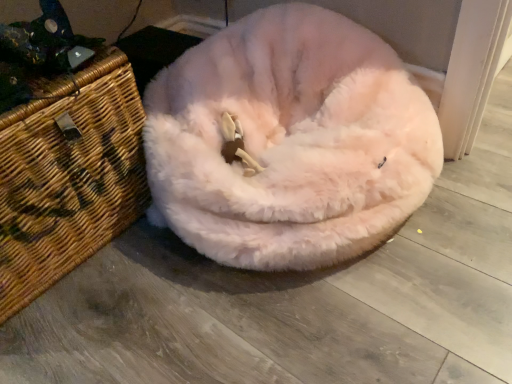
Question: Is woven brown basket at left positioned with its back to fuzzy white dog bed at center?

Choices:
 (A) no
 (B) yes

Answer: (A)

Question: Considering the relative sizes of woven brown basket at left and fuzzy white dog bed at center in the image provided, is woven brown basket at left shorter than fuzzy white dog bed at center?

Choices:
 (A) no
 (B) yes

Answer: (A)

Question: Is woven brown basket at left taller than fuzzy white dog bed at center?

Choices:
 (A) yes
 (B) no

Answer: (A)

Question: From the image's perspective, is woven brown basket at left on fuzzy white dog bed at center?

Choices:
 (A) no
 (B) yes

Answer: (A)

Question: Are woven brown basket at left and fuzzy white dog bed at center far apart?

Choices:
 (A) no
 (B) yes

Answer: (A)

Question: Is woven brown basket at left to the right of fuzzy white dog bed at center from the viewer's perspective?

Choices:
 (A) yes
 (B) no

Answer: (B)

Question: Is fuzzy white dog bed at center looking in the opposite direction of woven brown basket at left?

Choices:
 (A) yes
 (B) no

Answer: (B)

Question: Is fuzzy white dog bed at center further to the viewer compared to woven brown basket at left?

Choices:
 (A) no
 (B) yes

Answer: (A)

Question: Considering the relative sizes of fuzzy white dog bed at center and woven brown basket at left in the image provided, is fuzzy white dog bed at center taller than woven brown basket at left?

Choices:
 (A) yes
 (B) no

Answer: (B)

Question: From a real-world perspective, is fuzzy white dog bed at center on woven brown basket at left?

Choices:
 (A) no
 (B) yes

Answer: (A)

Question: Can you confirm if fuzzy white dog bed at center is smaller than woven brown basket at left?

Choices:
 (A) no
 (B) yes

Answer: (A)

Question: Is there a large distance between fuzzy white dog bed at center and woven brown basket at left?

Choices:
 (A) yes
 (B) no

Answer: (B)

Question: In terms of height, does woven brown basket at left look taller or shorter compared to fuzzy white dog bed at center?

Choices:
 (A) tall
 (B) short

Answer: (A)